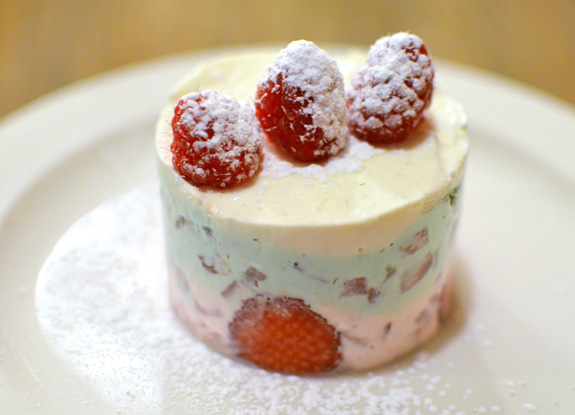
Locate an element on the screen. The height and width of the screenshot is (415, 575). wooden table is located at coordinates (65, 36).